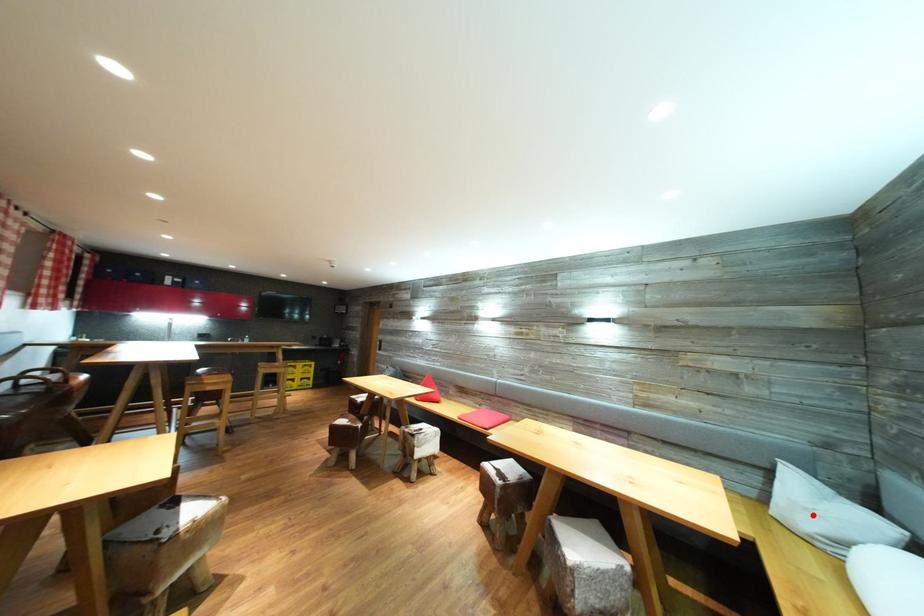
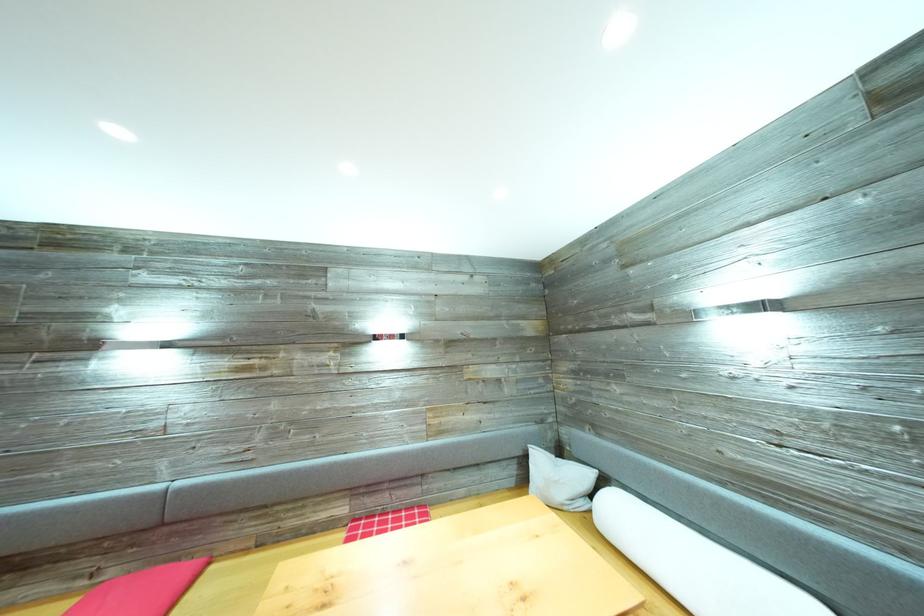
The point at the highlighted location is marked in the first image. Where is the corresponding point in the second image?

(563, 488)